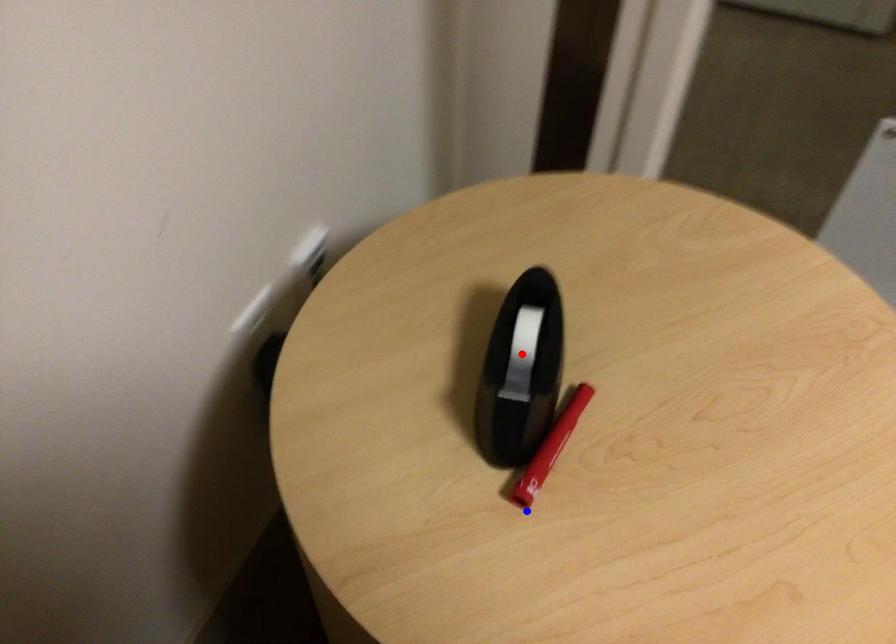
Question: In the image, two points are highlighted. Which point is nearer to the camera? Reply with the corresponding letter.

Choices:
 (A) blue point
 (B) red point

Answer: (A)